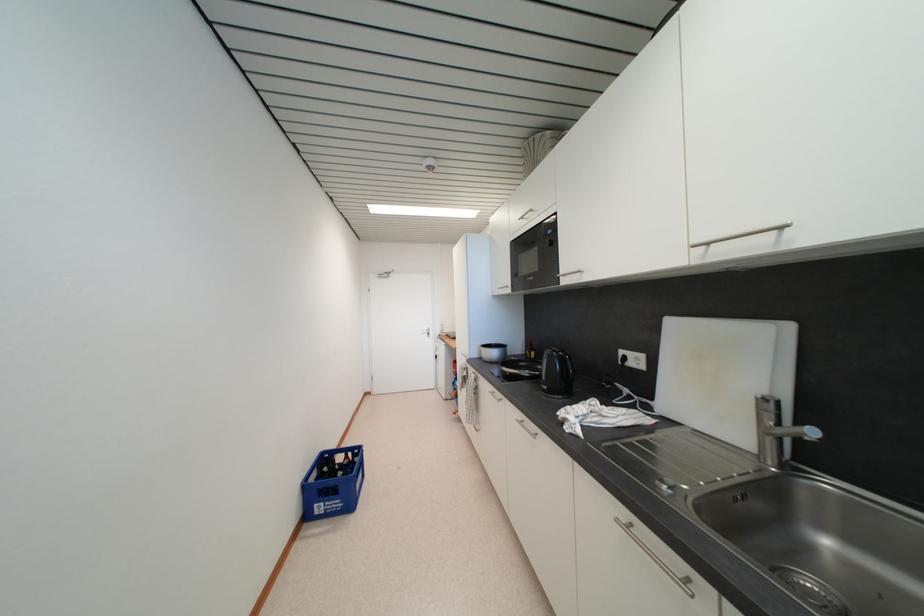
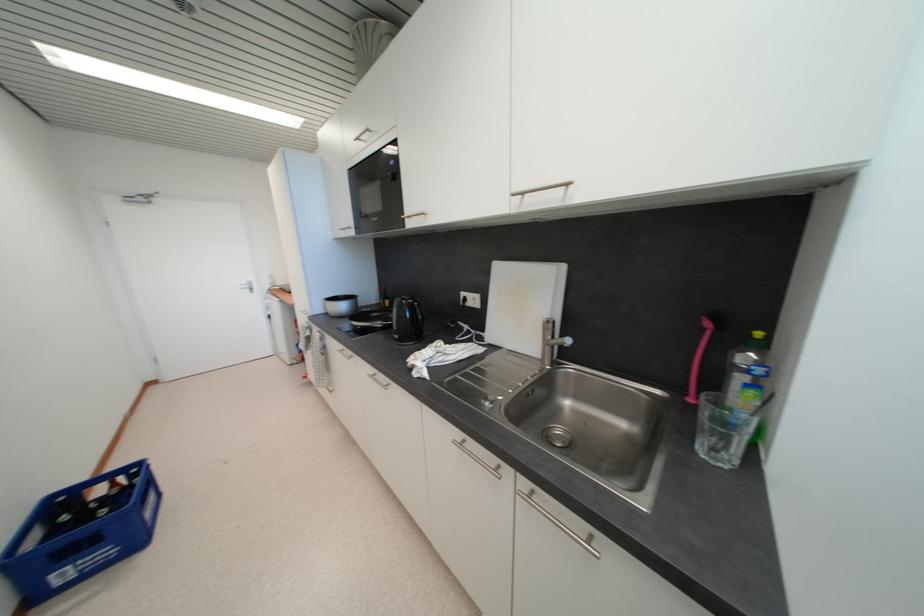
The point at (551, 390) is marked in the first image. Where is the corresponding point in the second image?

(402, 339)